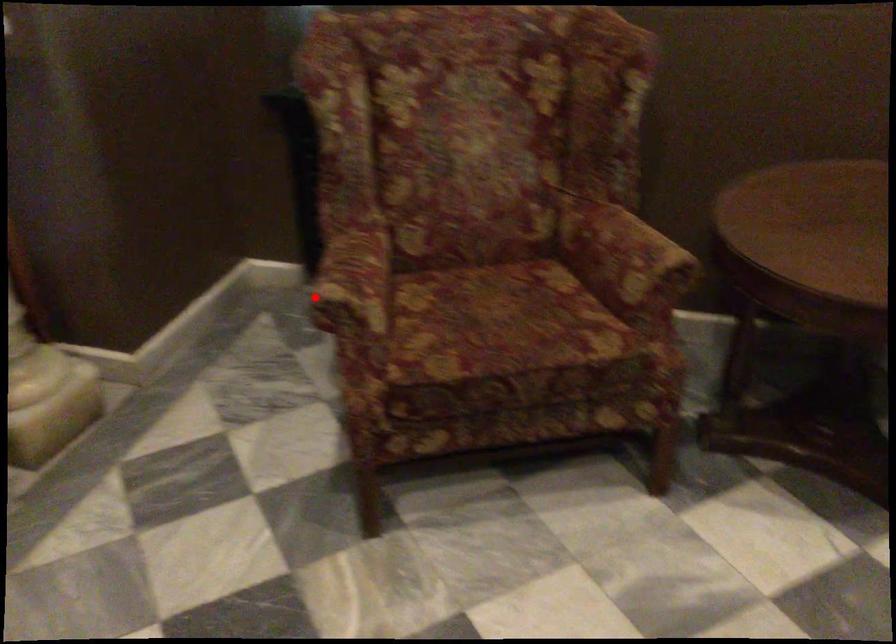
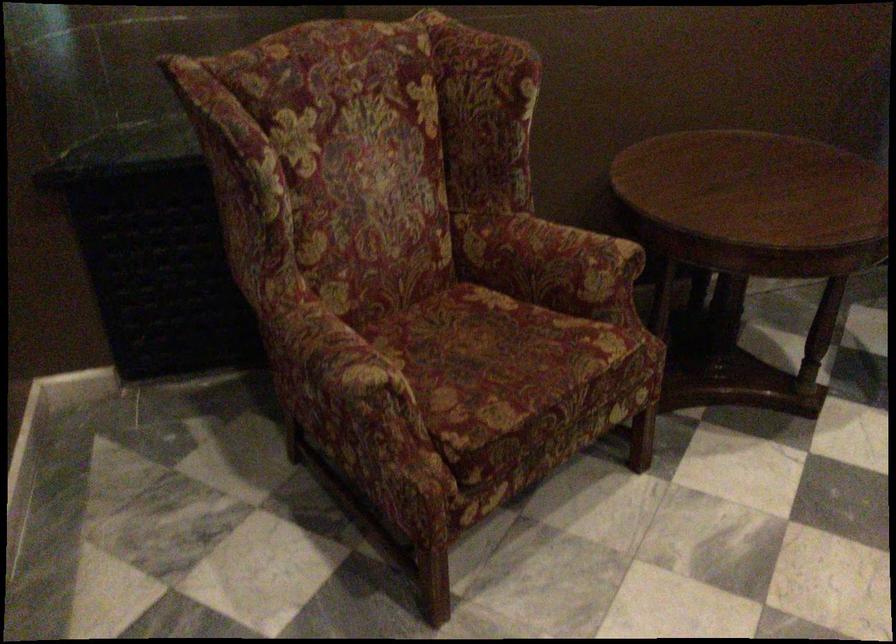
Question: I am providing you with two images of the same scene from different viewpoints. A red point is shown in image1. For the corresponding object point in image2, is it positioned nearer or farther from the camera?

Choices:
 (A) Nearer
 (B) Farther

Answer: (A)